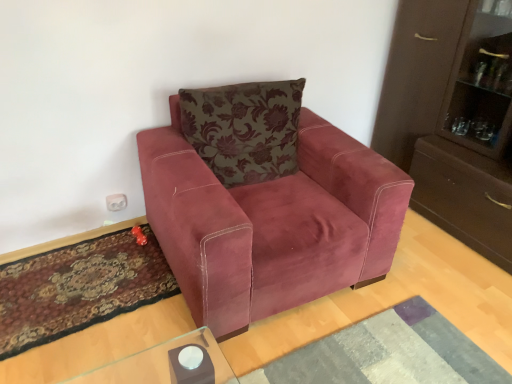
Question: From the image's perspective, is velvet floral pillow at center under textured gray mat at lower center, placed as the second mat when sorted from left to right?

Choices:
 (A) yes
 (B) no

Answer: (B)

Question: Considering the relative sizes of velvet floral pillow at center and textured gray mat at lower center, placed as the second mat when sorted from left to right, in the image provided, is velvet floral pillow at center shorter than textured gray mat at lower center, placed as the second mat when sorted from left to right,?

Choices:
 (A) no
 (B) yes

Answer: (A)

Question: Is the depth of velvet floral pillow at center less than that of textured gray mat at lower center, which is counted as the first mat, starting from the right?

Choices:
 (A) yes
 (B) no

Answer: (B)

Question: Would you say velvet floral pillow at center contains textured gray mat at lower center, placed as the second mat when sorted from left to right?

Choices:
 (A) yes
 (B) no

Answer: (B)

Question: Is velvet floral pillow at center taller than textured gray mat at lower center, placed as the second mat when sorted from left to right?

Choices:
 (A) no
 (B) yes

Answer: (B)

Question: Relative to textured gray mat at lower center, placed as the second mat when sorted from left to right, is carpeted rug at lower left, the 2th mat from the right, in front or behind?

Choices:
 (A) front
 (B) behind

Answer: (B)

Question: From a real-world perspective, is carpeted rug at lower left, which ranks as the first mat in left-to-right order, positioned above or below textured gray mat at lower center, placed as the second mat when sorted from left to right?

Choices:
 (A) above
 (B) below

Answer: (B)

Question: Considering the relative positions of carpeted rug at lower left, which ranks as the first mat in left-to-right order, and textured gray mat at lower center, which is counted as the first mat, starting from the right, in the image provided, is carpeted rug at lower left, which ranks as the first mat in left-to-right order, to the left or to the right of textured gray mat at lower center, which is counted as the first mat, starting from the right,?

Choices:
 (A) right
 (B) left

Answer: (B)

Question: Looking at the image, does carpeted rug at lower left, which ranks as the first mat in left-to-right order, seem bigger or smaller compared to textured gray mat at lower center, placed as the second mat when sorted from left to right?

Choices:
 (A) big
 (B) small

Answer: (B)

Question: Is textured gray mat at lower center, which is counted as the first mat, starting from the right, wider or thinner than velvet pink armchair at center?

Choices:
 (A) wide
 (B) thin

Answer: (B)

Question: Based on their sizes in the image, would you say textured gray mat at lower center, which is counted as the first mat, starting from the right, is bigger or smaller than velvet pink armchair at center?

Choices:
 (A) small
 (B) big

Answer: (A)

Question: Based on their positions, is textured gray mat at lower center, which is counted as the first mat, starting from the right, located to the left or right of velvet pink armchair at center?

Choices:
 (A) left
 (B) right

Answer: (B)

Question: Is textured gray mat at lower center, placed as the second mat when sorted from left to right, spatially inside velvet pink armchair at center, or outside of it?

Choices:
 (A) inside
 (B) outside

Answer: (B)

Question: Is velvet floral pillow at center bigger or smaller than textured gray mat at lower center, placed as the second mat when sorted from left to right?

Choices:
 (A) big
 (B) small

Answer: (A)

Question: Does point (236, 165) appear closer or farther from the camera than point (358, 372)?

Choices:
 (A) farther
 (B) closer

Answer: (A)